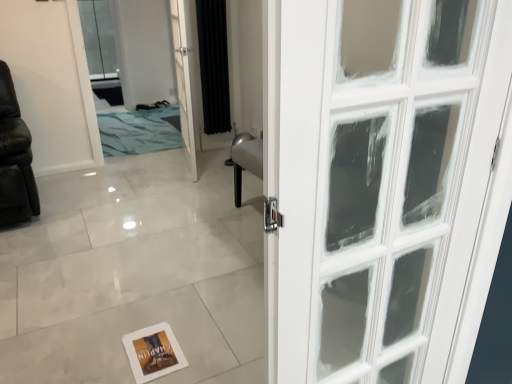
Question: Is the position of black fabric curtain at center less distant than that of white glass door at center?

Choices:
 (A) yes
 (B) no

Answer: (B)

Question: Is the surface of black fabric curtain at center in direct contact with white glass door at center?

Choices:
 (A) no
 (B) yes

Answer: (A)

Question: From the image's perspective, is black fabric curtain at center over white glass door at center?

Choices:
 (A) no
 (B) yes

Answer: (B)

Question: Is black fabric curtain at center facing towards white glass door at center?

Choices:
 (A) no
 (B) yes

Answer: (A)

Question: Is black fabric curtain at center far from white glass door at center?

Choices:
 (A) yes
 (B) no

Answer: (B)

Question: In the image, is blue fabric bed at upper left positioned in front of or behind white glass door at center?

Choices:
 (A) behind
 (B) front

Answer: (A)

Question: In terms of size, does blue fabric bed at upper left appear bigger or smaller than white glass door at center?

Choices:
 (A) small
 (B) big

Answer: (A)

Question: From their relative heights in the image, would you say blue fabric bed at upper left is taller or shorter than white glass door at center?

Choices:
 (A) short
 (B) tall

Answer: (B)

Question: Is blue fabric bed at upper left inside the boundaries of white glass door at center, or outside?

Choices:
 (A) outside
 (B) inside

Answer: (A)

Question: Is white paper postcard at lower center bigger or smaller than black fabric curtain at center?

Choices:
 (A) small
 (B) big

Answer: (A)

Question: Is point (160, 340) closer or farther from the camera than point (212, 13)?

Choices:
 (A) farther
 (B) closer

Answer: (B)

Question: Is white paper postcard at lower center wider or thinner than black fabric curtain at center?

Choices:
 (A) thin
 (B) wide

Answer: (B)

Question: From a real-world perspective, is white paper postcard at lower center physically located above or below black fabric curtain at center?

Choices:
 (A) above
 (B) below

Answer: (B)

Question: Considering the positions of white glass door at center and clear glass window at upper left in the image, is white glass door at center wider or thinner than clear glass window at upper left?

Choices:
 (A) thin
 (B) wide

Answer: (A)

Question: Considering the positions of white glass door at center and clear glass window at upper left in the image, is white glass door at center bigger or smaller than clear glass window at upper left?

Choices:
 (A) small
 (B) big

Answer: (B)